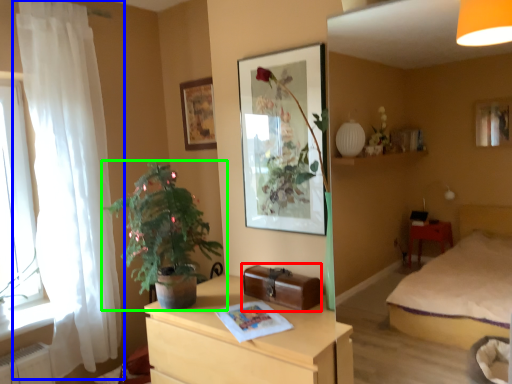
Question: Estimate the real-world distances between objects in this image. Which object is closer to luggage (highlighted by a red box), curtain (highlighted by a blue box) or houseplant (highlighted by a green box)?

Choices:
 (A) curtain
 (B) houseplant

Answer: (B)